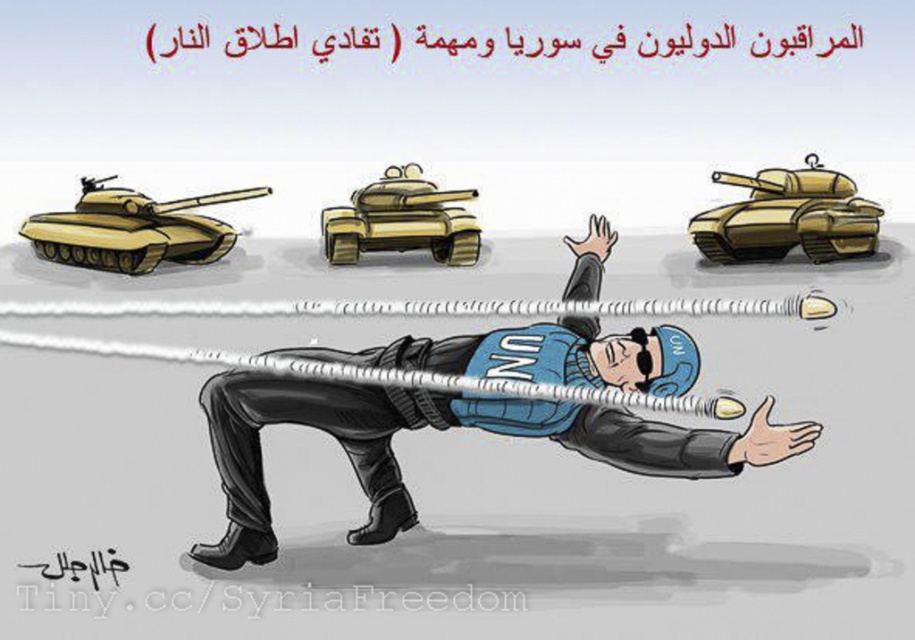
Question: Which point is farther from the camera taking this photo?

Choices:
 (A) (404, 177)
 (B) (238, 541)

Answer: (A)

Question: Is blue fabric un vest at center in front of gold metallic tank at center?

Choices:
 (A) yes
 (B) no

Answer: (A)

Question: Does gold metallic tank at upper right appear under matte yellow tank at left?

Choices:
 (A) no
 (B) yes

Answer: (A)

Question: In this image, where is blue fabric un vest at center located relative to gold metallic tank at center?

Choices:
 (A) below
 (B) above

Answer: (A)

Question: Considering the real-world distances, which object is farthest from the blue fabric un vest at center?

Choices:
 (A) matte yellow tank at left
 (B) gold metallic tank at upper right

Answer: (A)

Question: Considering the real-world distances, which object is closest to the matte yellow tank at left?

Choices:
 (A) gold metallic tank at upper right
 (B) gold metallic tank at center

Answer: (B)